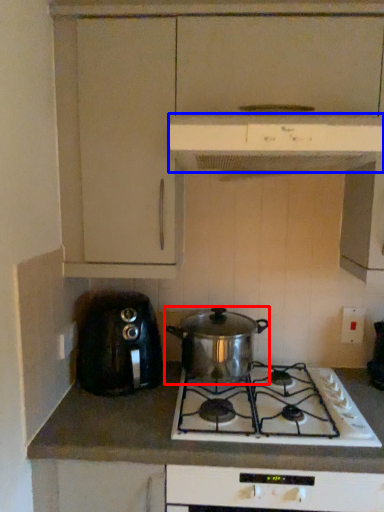
Question: Which object appears closest to the camera in this image, kitchen appliance (highlighted by a red box) or kitchen appliance (highlighted by a blue box)?

Choices:
 (A) kitchen appliance
 (B) kitchen appliance

Answer: (B)